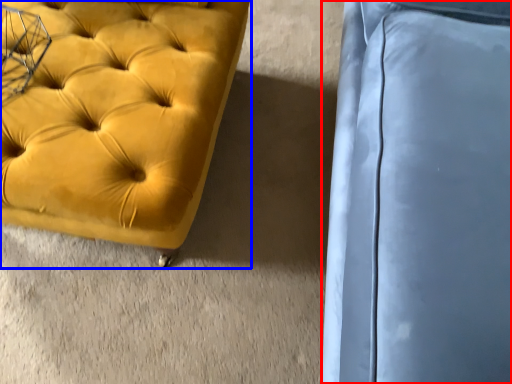
Question: Which object is closer to the camera taking this photo, swivel chair (highlighted by a red box) or furniture (highlighted by a blue box)?

Choices:
 (A) swivel chair
 (B) furniture

Answer: (A)